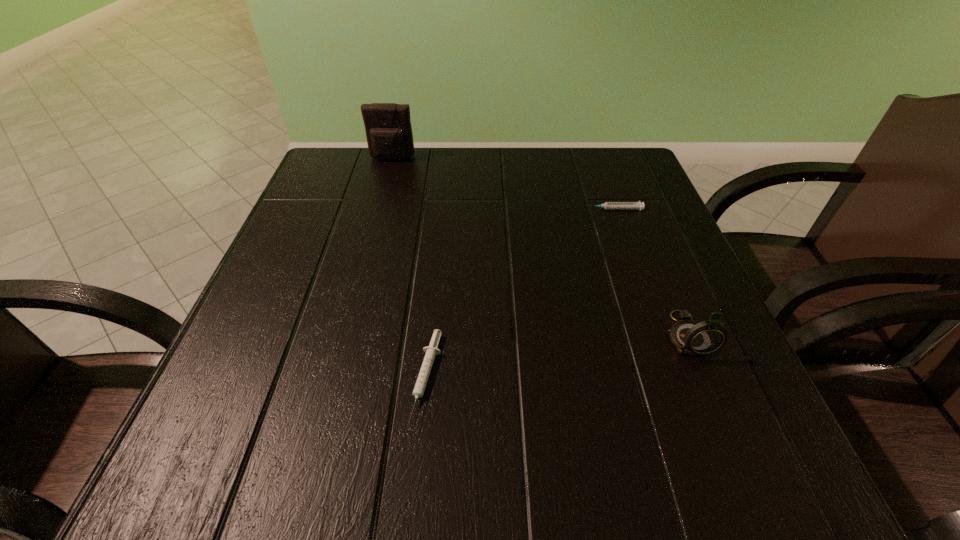
At what (x,y) coordinates should I click in order to perform the action: click on vacant area situated at the needle end of the right syringe. Please return your answer as a coordinate pair (x, y). This screenshot has width=960, height=540. Looking at the image, I should click on (425, 209).

Where is `vacant region located 0.270m at the needle end of the right syringe`? This screenshot has width=960, height=540. vacant region located 0.270m at the needle end of the right syringe is located at coordinates (462, 209).

This screenshot has width=960, height=540. In order to click on blank space located 0.240m on the right of the left syringe in this screenshot , I will do `click(598, 377)`.

Image resolution: width=960 pixels, height=540 pixels. What are the coordinates of `object that is at the far edge` in the screenshot? It's located at (388, 128).

Identify the location of object that is at the near edge. (431, 351).

This screenshot has width=960, height=540. Find the location of `object that is at the left edge`. object that is at the left edge is located at coordinates (388, 128).

Locate an element on the screen. The height and width of the screenshot is (540, 960). compass positioned at the right edge is located at coordinates (690, 337).

The width and height of the screenshot is (960, 540). I want to click on syringe located in the right edge section of the desktop, so click(607, 205).

Where is `object that is at the far left corner`? This screenshot has width=960, height=540. object that is at the far left corner is located at coordinates (388, 128).

Locate an element on the screen. The height and width of the screenshot is (540, 960). vacant point at the far edge is located at coordinates (569, 198).